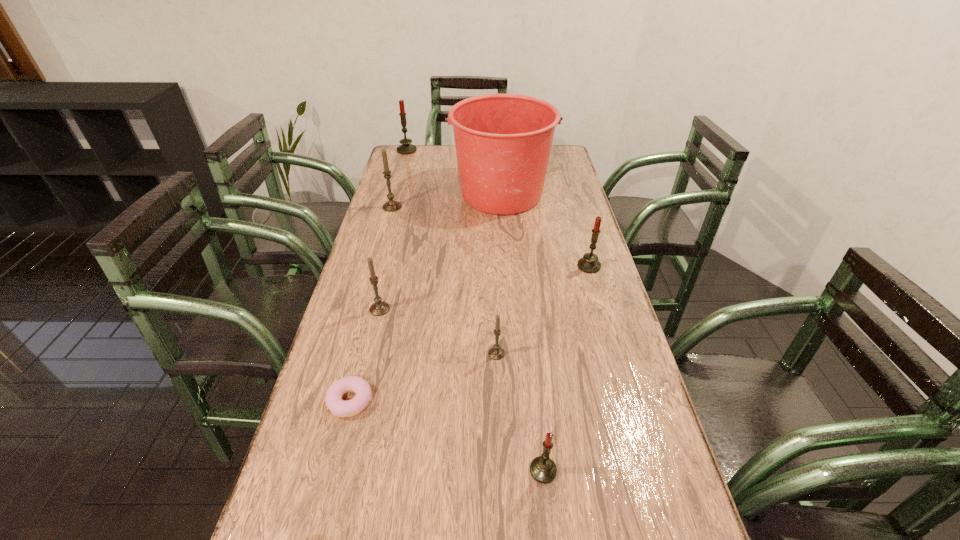
You are a GUI agent. You are given a task and a screenshot of the screen. Output one action in this format:
    pyautogui.click(x=<x>, y=<y>)
    Task: Click on the free spot located on the back of the third nearest candle
    This screenshot has height=540, width=960.
    Given the screenshot: What is the action you would take?
    pos(395,248)

Where is `vacant space located on the back of the second red candle from right to left`? This screenshot has height=540, width=960. vacant space located on the back of the second red candle from right to left is located at coordinates pos(528,332).

The width and height of the screenshot is (960, 540). I want to click on vacant space located on the left of the smallest gray candle, so click(x=468, y=354).

Locate an element on the screen. The height and width of the screenshot is (540, 960). vacant point located 0.360m on the back of the shortest object is located at coordinates click(x=381, y=281).

The width and height of the screenshot is (960, 540). Identify the location of bucket that is at the far edge. (503, 142).

Identify the location of candle situated at the far edge. (405, 148).

This screenshot has width=960, height=540. In order to click on doughnut that is at the left edge in this screenshot , I will do `click(333, 399)`.

Locate an element on the screen. bucket that is at the right edge is located at coordinates (503, 142).

The height and width of the screenshot is (540, 960). What are the coordinates of `candle present at the right edge` in the screenshot? It's located at (589, 263).

This screenshot has height=540, width=960. What are the coordinates of `object at the far left corner` in the screenshot? It's located at (405, 148).